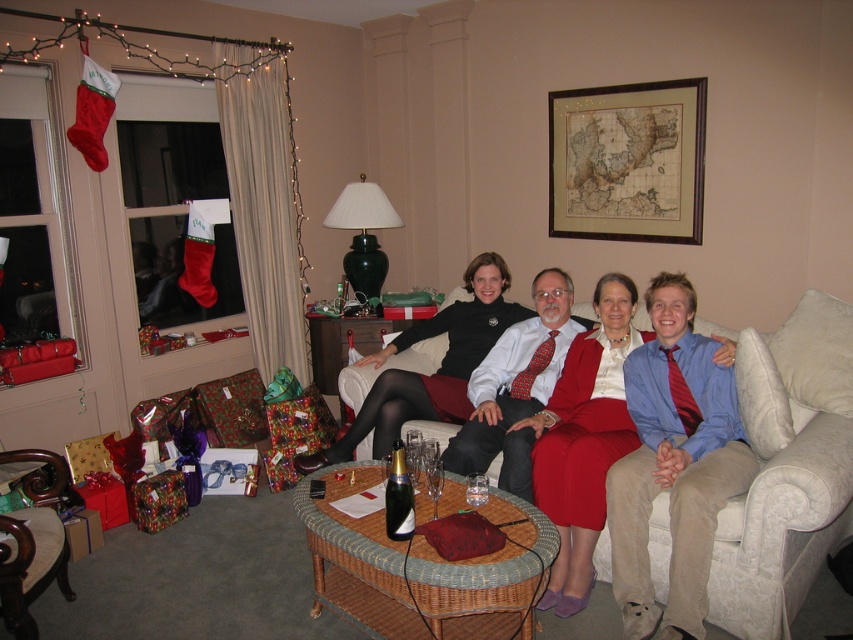
Is point (625, 305) positioned after point (395, 470)?

Yes, point (625, 305) is behind point (395, 470).

Identify the location of matte black dress at center. (584, 440).

Can you confirm if matte black dress at center is wider than dark wood armchair at lower left?

Correct, the width of matte black dress at center exceeds that of dark wood armchair at lower left.

Between matte black dress at center and dark wood armchair at lower left, which one is positioned lower?

dark wood armchair at lower left is lower down.

In order to click on matte black dress at center in this screenshot , I will do `click(584, 440)`.

Does velvet white couch at center appear on the right side of transparent glass wine glass at center?

Indeed, velvet white couch at center is positioned on the right side of transparent glass wine glass at center.

In the scene shown: Who is positioned more to the right, velvet white couch at center or transparent glass wine glass at center?

Positioned to the right is velvet white couch at center.

Find the location of a particular element. The image size is (853, 640). velvet white couch at center is located at coordinates (786, 468).